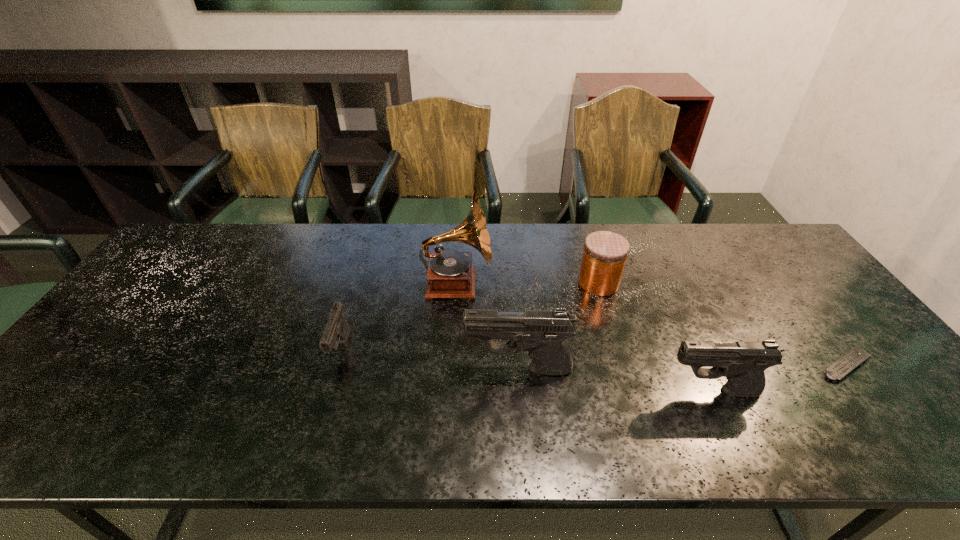
This screenshot has width=960, height=540. Find the location of `the shortest pistol`. the shortest pistol is located at coordinates (337, 330).

This screenshot has height=540, width=960. Identify the location of the leftmost pistol. (337, 330).

Identify the location of the second pistol from left to right. (542, 333).

This screenshot has width=960, height=540. I want to click on the fifth object from left to right, so click(743, 364).

Find the location of `the nearest object`. the nearest object is located at coordinates (743, 364).

Find the location of `the third object from right to left`. the third object from right to left is located at coordinates (605, 253).

Where is `the shortest object`? The height and width of the screenshot is (540, 960). the shortest object is located at coordinates (843, 366).

Find the location of a particular element. The image size is (960, 540). remote control is located at coordinates (843, 366).

Locate an element on the screen. This screenshot has height=540, width=960. phonograph_record is located at coordinates (451, 274).

Locate an element on the screen. The height and width of the screenshot is (540, 960). vacant space situated 0.350m at the barrel of the second pistol from left to right is located at coordinates (322, 369).